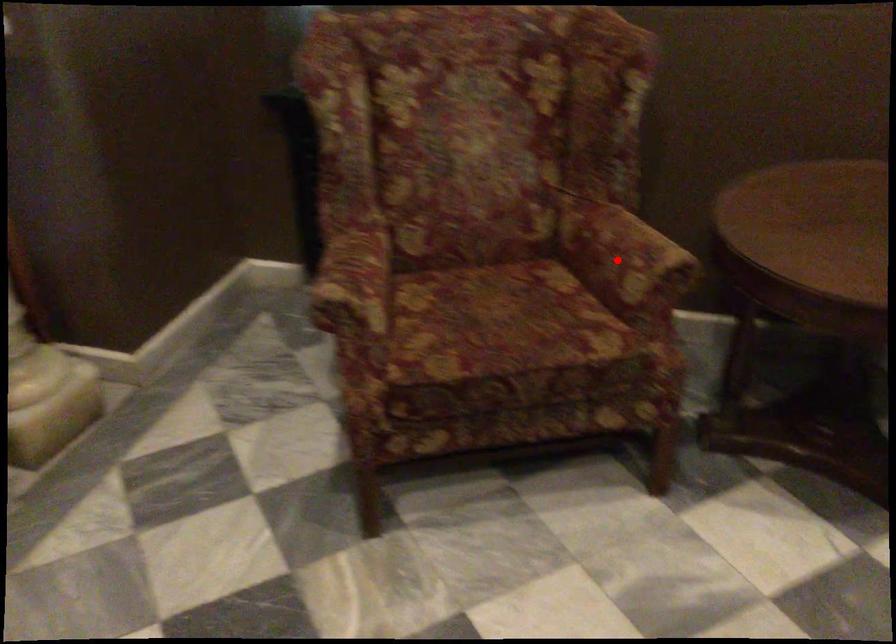
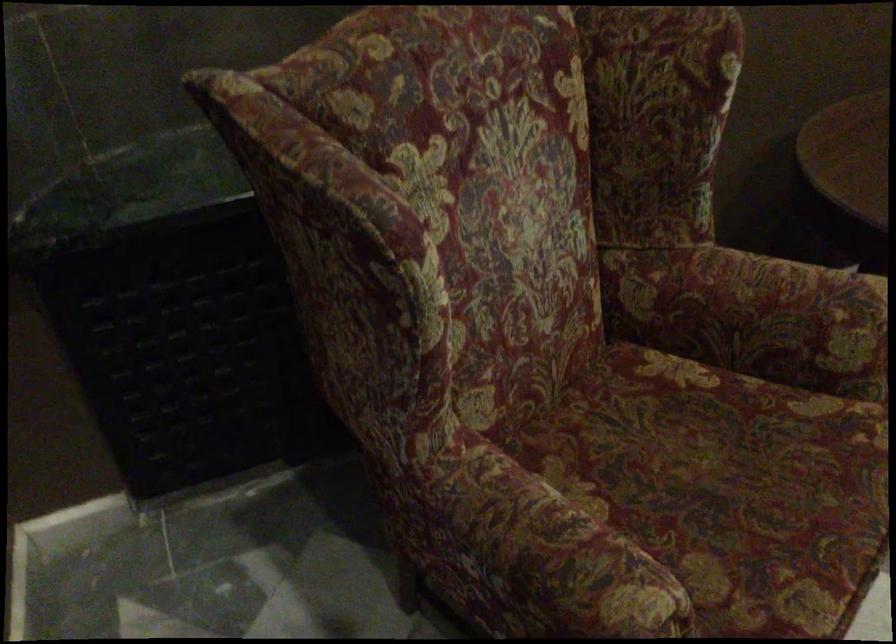
Question: I am providing you with two images of the same scene from different viewpoints. Image1 has a red point marked. In image2, the corresponding 3D location appears at what relative position? Reply with the corresponding letter.

Choices:
 (A) Closer
 (B) Farther

Answer: (A)